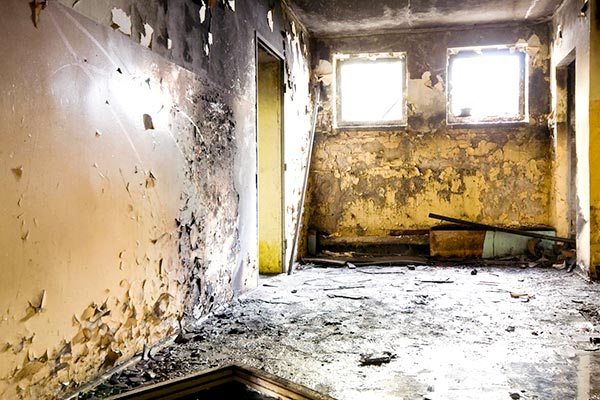
At what (x,y) coordinates should I click in order to perform the action: click on trim. Please return your answer as a coordinate pair (x, y). Looking at the image, I should click on (276, 51), (257, 113), (278, 136).